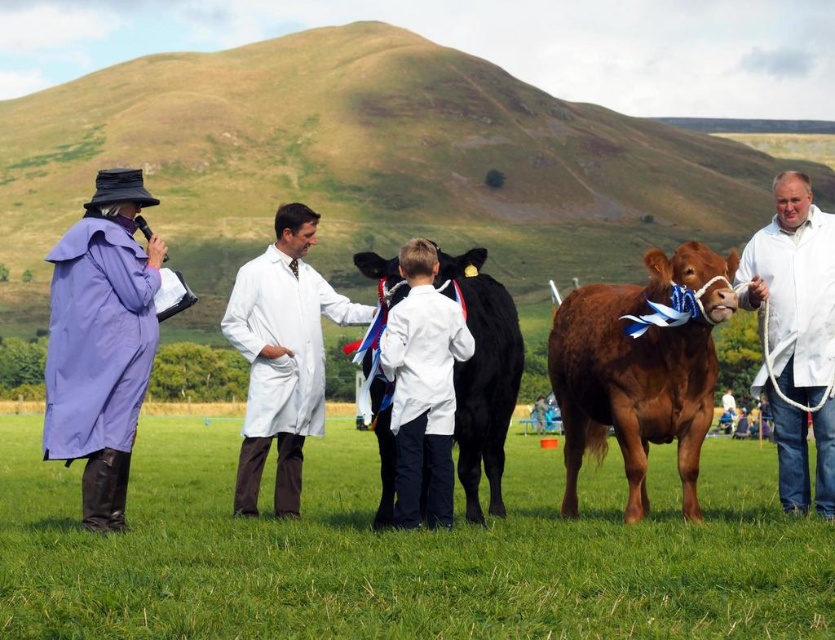
Which is more to the left, purple fabric coat at left or white matte coat at center?

Positioned to the left is purple fabric coat at left.

What do you see at coordinates (100, 340) in the screenshot?
I see `purple fabric coat at left` at bounding box center [100, 340].

Find the location of a particular element. The height and width of the screenshot is (640, 835). purple fabric coat at left is located at coordinates (100, 340).

What are the coordinates of `purple fabric coat at left` in the screenshot? It's located at (100, 340).

Is brown glossy cow at center positioned at the back of white matte coat at center?

That is True.

The height and width of the screenshot is (640, 835). I want to click on brown glossy cow at center, so [x=641, y=369].

Which is more to the left, white matte coat at center or black glossy cow at center?

black glossy cow at center

The height and width of the screenshot is (640, 835). Describe the element at coordinates (795, 337) in the screenshot. I see `white matte coat at center` at that location.

Locate an element on the screen. The height and width of the screenshot is (640, 835). white matte coat at center is located at coordinates (795, 337).